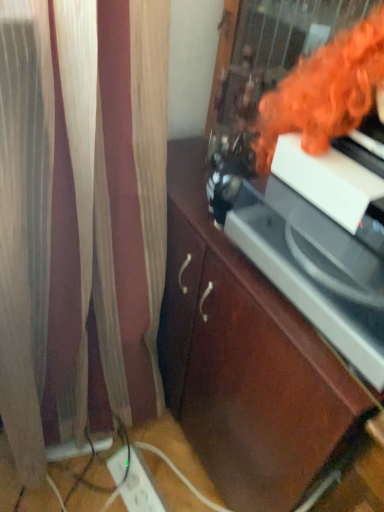
Question: From a real-world perspective, is white plastic extension cord at lower left positioned above or below brown wood cabinet at center?

Choices:
 (A) below
 (B) above

Answer: (A)

Question: From their relative heights in the image, would you say white plastic extension cord at lower left is taller or shorter than brown wood cabinet at center?

Choices:
 (A) short
 (B) tall

Answer: (A)

Question: Based on their relative distances, which object is farther from the brown wood cabinet at center?

Choices:
 (A) orange fabric at upper right
 (B) white glossy record player at center
 (C) white plastic extension cord at lower left

Answer: (C)

Question: Which object is the closest to the white glossy record player at center?

Choices:
 (A) white plastic extension cord at lower left
 (B) brown wood cabinet at center
 (C) orange fabric at upper right

Answer: (C)